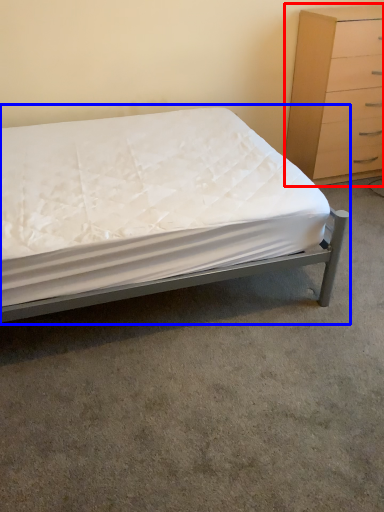
Question: Which object is closer to the camera taking this photo, chest of drawers (highlighted by a red box) or bed (highlighted by a blue box)?

Choices:
 (A) chest of drawers
 (B) bed

Answer: (B)